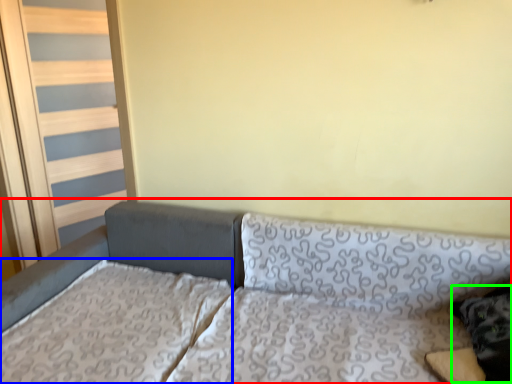
Question: Considering the real-world distances, which object is farthest from studio couch (highlighted by a red box)? mattress (highlighted by a blue box) or pillow (highlighted by a green box)?

Choices:
 (A) mattress
 (B) pillow

Answer: (B)